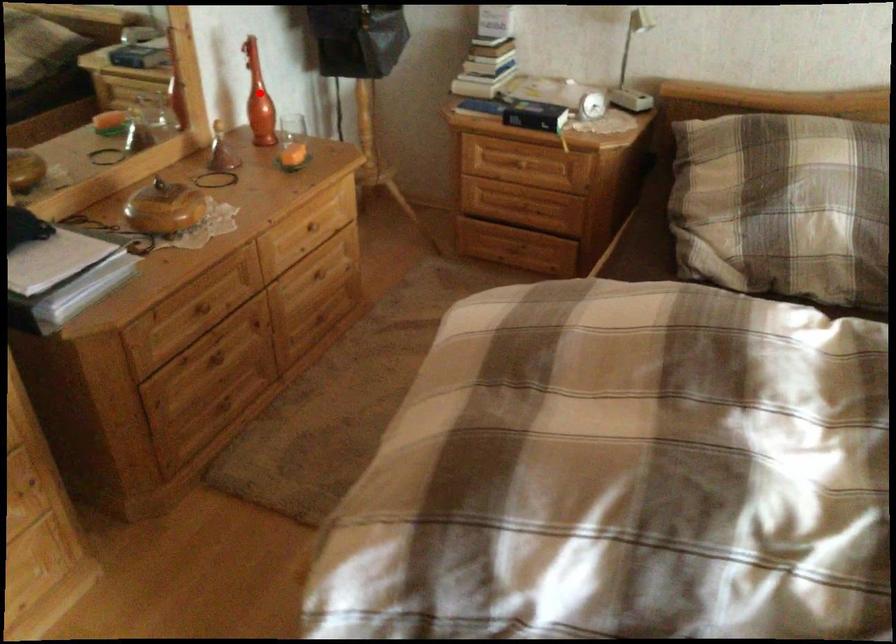
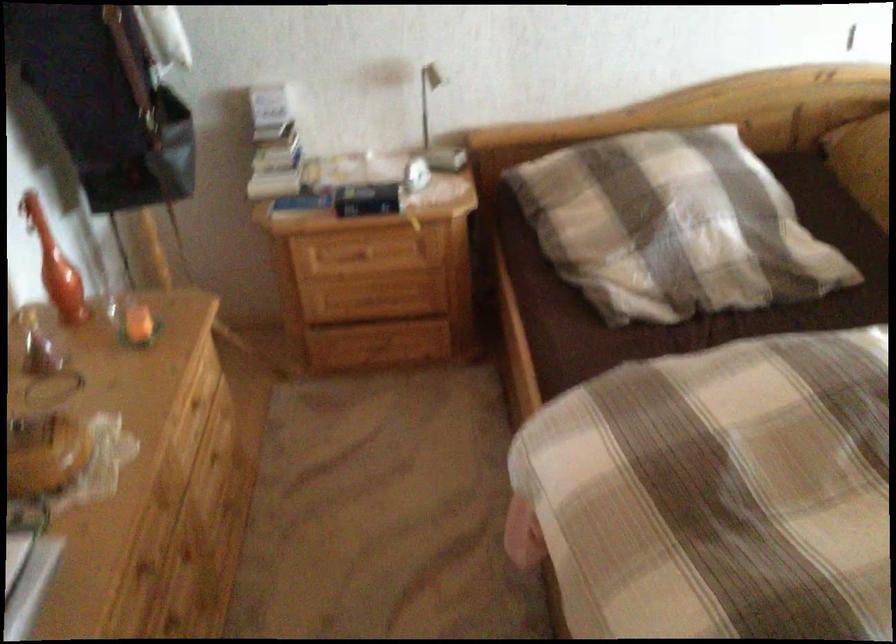
Question: I am providing you with two images of the same scene from different viewpoints. In image1, a red point is highlighted. Considering the same 3D point in image2, which of the following is correct?

Choices:
 (A) It is closer
 (B) It is farther

Answer: (A)